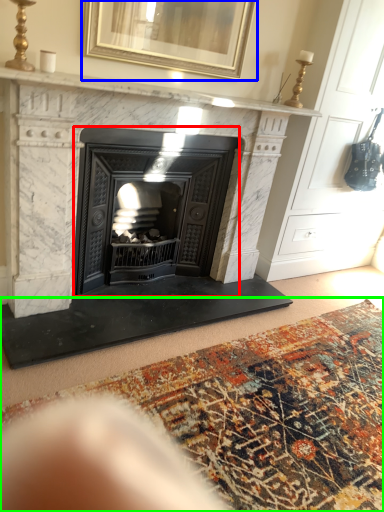
Question: Considering the real-world distances, which object is farthest from wood burning stove (highlighted by a red box)? picture frame (highlighted by a blue box) or mat (highlighted by a green box)?

Choices:
 (A) picture frame
 (B) mat

Answer: (B)